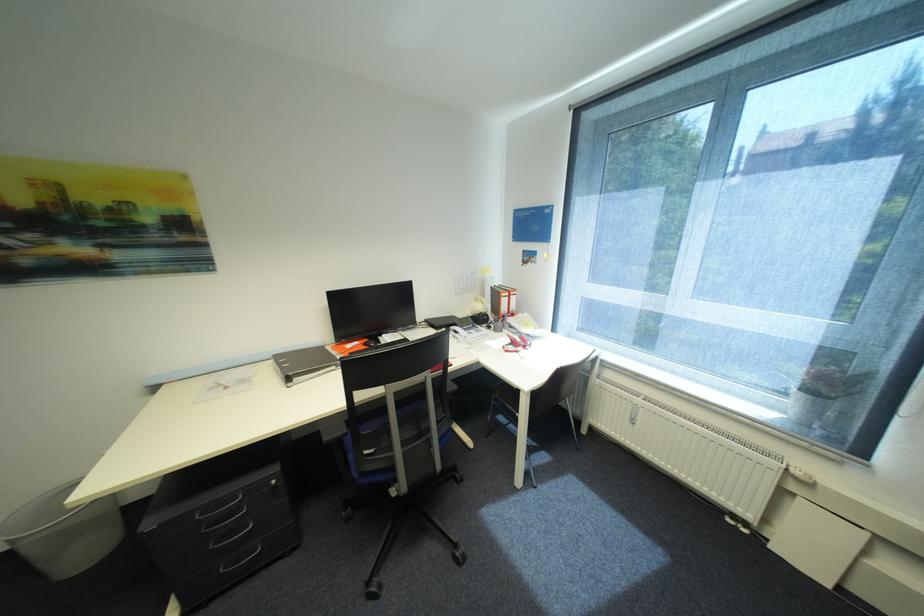
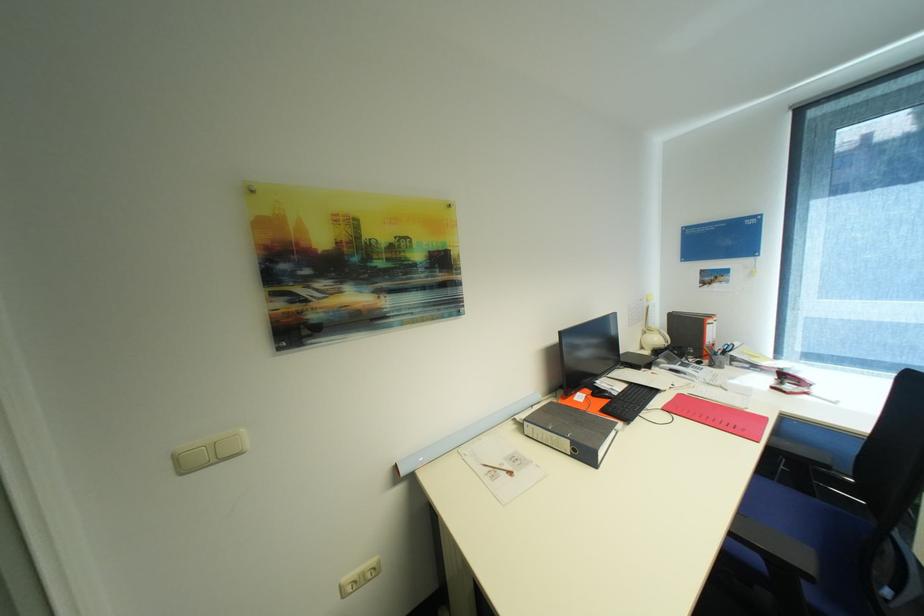
Where in the second image is the point corresponding to [518,347] from the first image?

(796, 387)